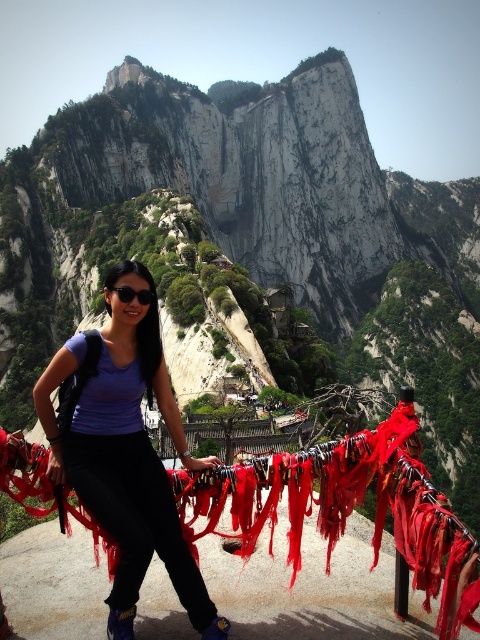
Which is more to the right, red fabric ribbon at center or matte purple shirt at center?

Positioned to the right is red fabric ribbon at center.

Between point (237, 476) and point (85, 486), which one is positioned behind?

Positioned behind is point (237, 476).

Which is behind, point (297, 486) or point (160, 365)?

Point (160, 365)

Where is `red fabric ribbon at center`? Image resolution: width=480 pixels, height=640 pixels. red fabric ribbon at center is located at coordinates (346, 508).

Between smooth white rock at center and red fabric ribbon at center, which one is positioned lower?

red fabric ribbon at center is below.

Does smooth white rock at center have a greater width compared to red fabric ribbon at center?

Correct, the width of smooth white rock at center exceeds that of red fabric ribbon at center.

Find the location of `smooth white rock at center`. smooth white rock at center is located at coordinates (256, 227).

Does smooth white rock at center appear on the left side of matte purple shirt at center?

No, smooth white rock at center is not to the left of matte purple shirt at center.

Is point (479, 284) positioned in front of point (144, 310)?

No, it is behind (144, 310).

Measure the distance between smooth white rock at center and camera.

smooth white rock at center is 78.25 meters away from camera.

Locate an element on the screen. The height and width of the screenshot is (640, 480). smooth white rock at center is located at coordinates (256, 227).